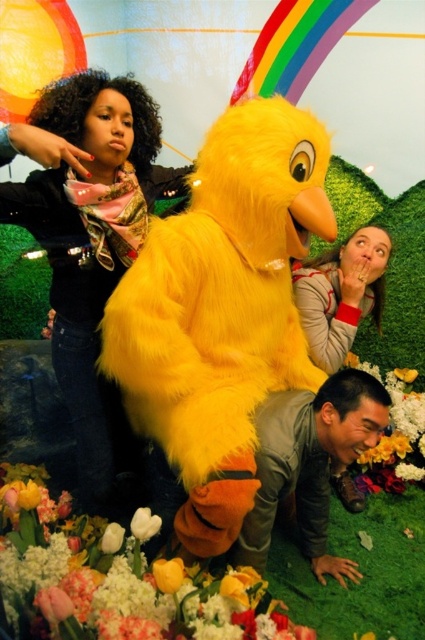
You are a gardener who needs to place a new plant between the yellow matte flower at lower center and the white matte tulip at center. The plant requires at least 6 inches of space to grow properly. Based on the scene, will there be enough space for the new plant?

The distance between the yellow matte flower at lower center and the white matte tulip at center is 5.93 inches. Since the required space is 6 inches, there is not enough space for the new plant to grow properly.

You are a child who is 1.2 meters tall standing in front of the fluffy yellow bird at center. Can you reach the top of its head to touch it?

The fluffy yellow bird at center is 1.57 meters away from the viewer. Since the child is 1.2 meters tall, they may not be able to reach the top of its head unless they jump or stand on something.

You are a photographer standing in front of the large, plush yellow bird character. You want to take a photo of the matte black jacket at upper left without including the bird in the frame. Can you step back enough to exclude the bird while still capturing the jacket in your shot?

The matte black jacket at upper left is 1.48 meters away from the viewer. To exclude the bird while capturing the jacket, you would need to step back so that the jacket remains in frame but the bird is out. However, the jacket is relatively close, so stepping back might require a wide angle or adjusting your position to ensure the jacket stays visible without the bird.